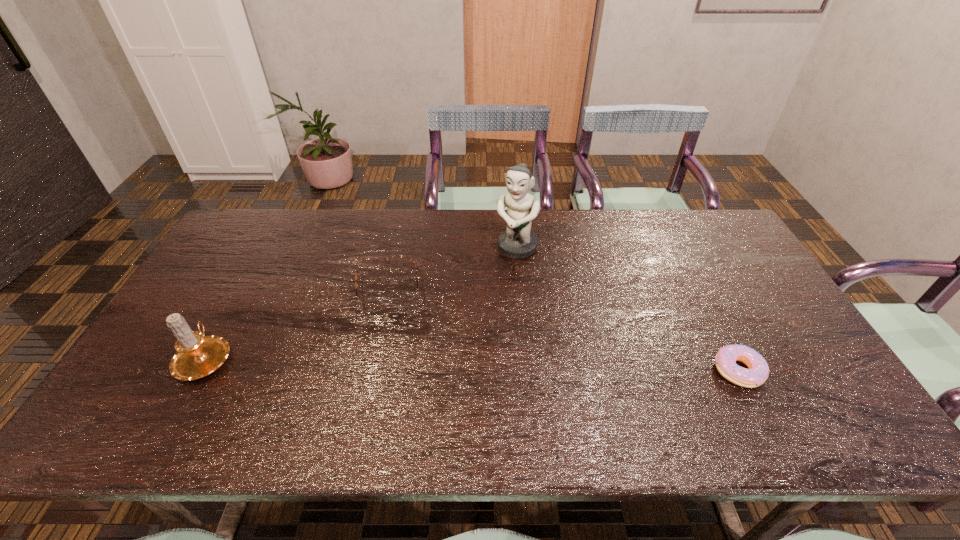
This screenshot has height=540, width=960. Find the location of `vacant space that satisfies the following two spatial constraints: 1. on the back side of the farthest object; 2. on the left side of the candle`. vacant space that satisfies the following two spatial constraints: 1. on the back side of the farthest object; 2. on the left side of the candle is located at coordinates (267, 248).